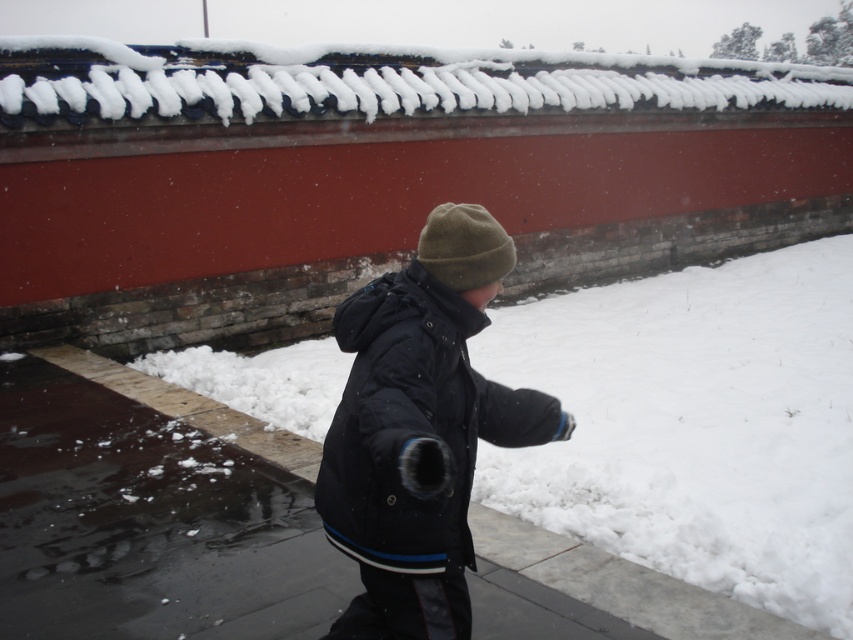
You are a photographer trying to capture the child in the snowy scene. You need to position your camera so that the green woolen beanie at center is on the right side of the black matte jacket at center in the photo. Is this possible based on the current arrangement?

Yes, because the black matte jacket at center is to the left of the green woolen beanie at center, so positioning the camera appropriately would allow the green woolen beanie at center to appear on the right side of the black matte jacket at center in the photo.